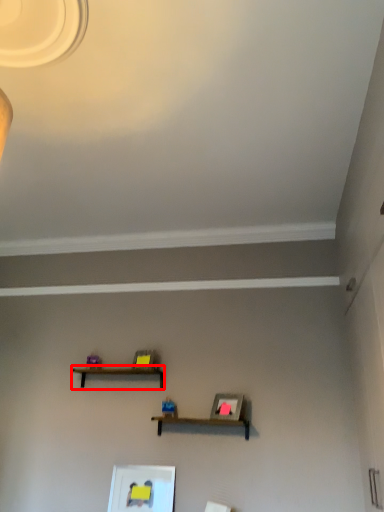
Question: Considering the relative positions of shelf (annotated by the red box) and picture frame in the image provided, where is shelf (annotated by the red box) located with respect to the staircase?

Choices:
 (A) left
 (B) right

Answer: (A)